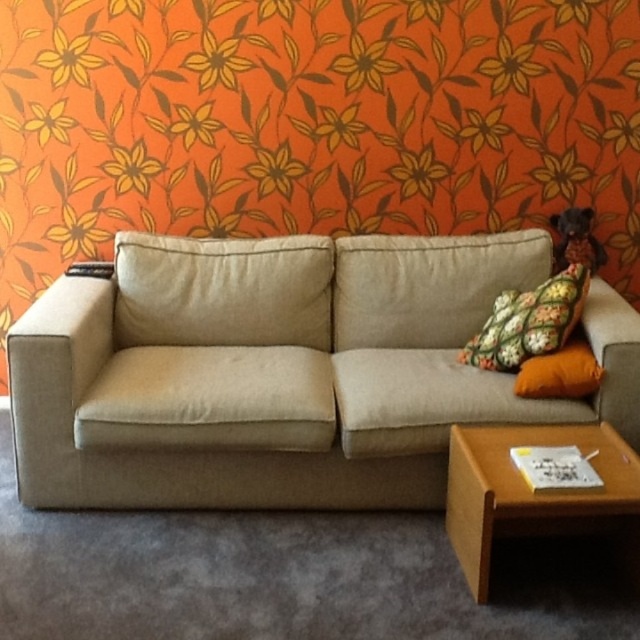
Is point (44, 492) in front of point (560, 352)?

Yes, point (44, 492) is closer to viewer.

Is point (368, 451) more distant than point (554, 387)?

No, (368, 451) is in front of (554, 387).

Locate an element on the screen. This screenshot has width=640, height=640. beige fabric couch at center is located at coordinates (282, 371).

Is beige fabric couch at center shorter than floral fabric pillow at right?

No.

Can you confirm if beige fabric couch at center is bigger than floral fabric pillow at right?

Yes, beige fabric couch at center is bigger than floral fabric pillow at right.

This screenshot has width=640, height=640. What are the coordinates of `beige fabric couch at center` in the screenshot? It's located at tap(282, 371).

Is point (570, 332) in front of point (538, 365)?

That is False.

Who is more distant from viewer, [500,323] or [582,381]?

The point [500,323] is more distant.

The image size is (640, 640). In order to click on floral fabric pillow at right in this screenshot , I will do `click(529, 321)`.

The image size is (640, 640). Identify the location of floral fabric pillow at right. (529, 321).